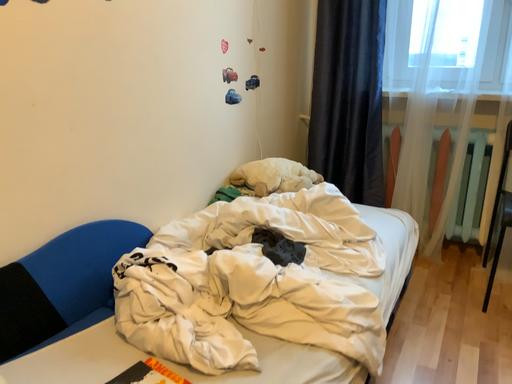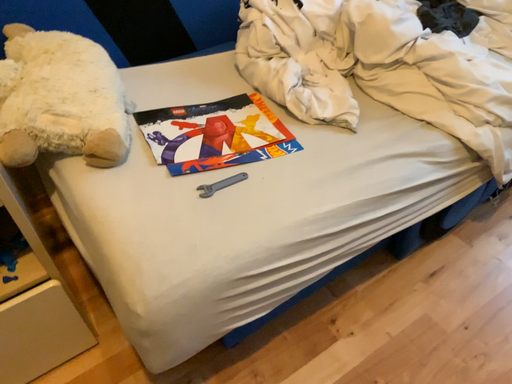
Question: Which way did the camera rotate in the video?

Choices:
 (A) rotated downward
 (B) rotated upward

Answer: (A)